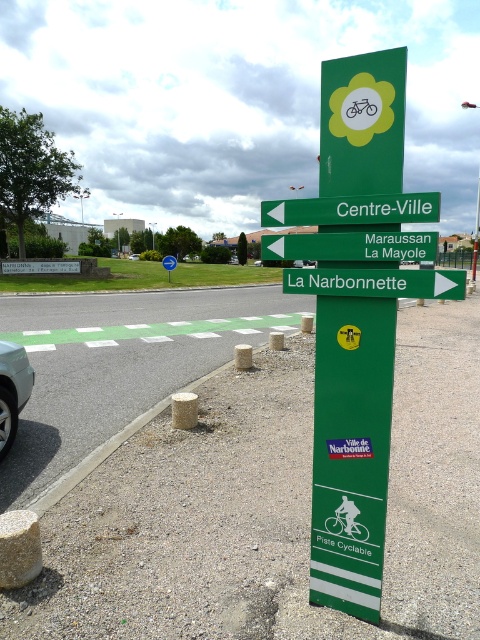
You are standing at the camera position and want to reach the point at coordinates (351, 248). Can you walk directly to it in a straight line without any obstacles?

The distance between you and the point at coordinates (351, 248) is 2.42 meters. Since there are no obstacles mentioned in the scene description, you can walk directly to it in a straight line.

You are standing at the side of the road looking at the green directional signpost. You need to check if you can reach the green plastic sign at upper center with a 2.5 meter long pole. Can you reach it?

The green plastic sign at upper center is 2.29 meters away from the viewer. Since the pole is 2.5 meters long, it is longer than the distance to the sign, so yes, you can reach the green plastic sign at upper center with the pole.

You are standing in front of the signpost and want to take a photo. Which of the two points, point (444, 298) or point (254, 266), will appear larger in your camera view?

Point (444, 298) is closer to the camera than point (254, 266), so it will appear larger in the photo.